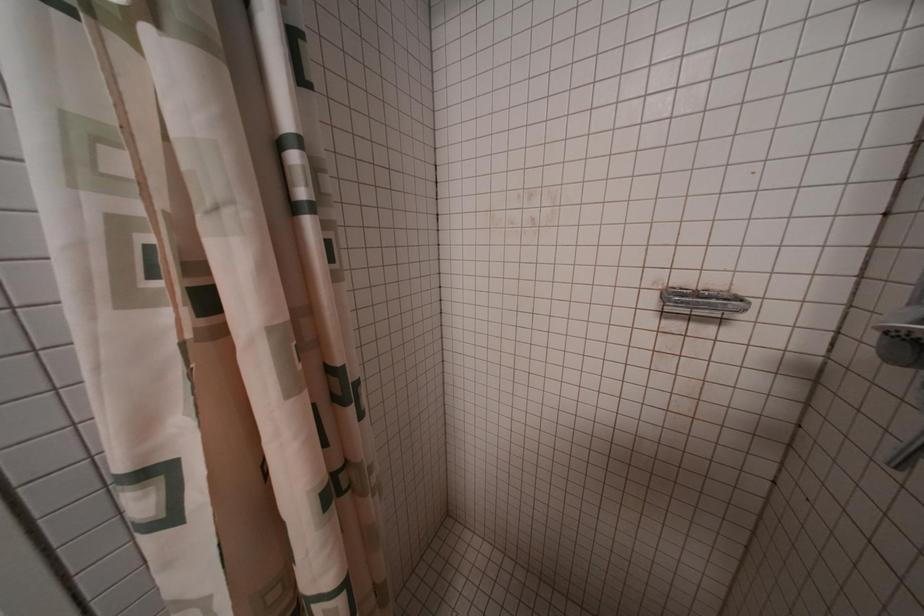
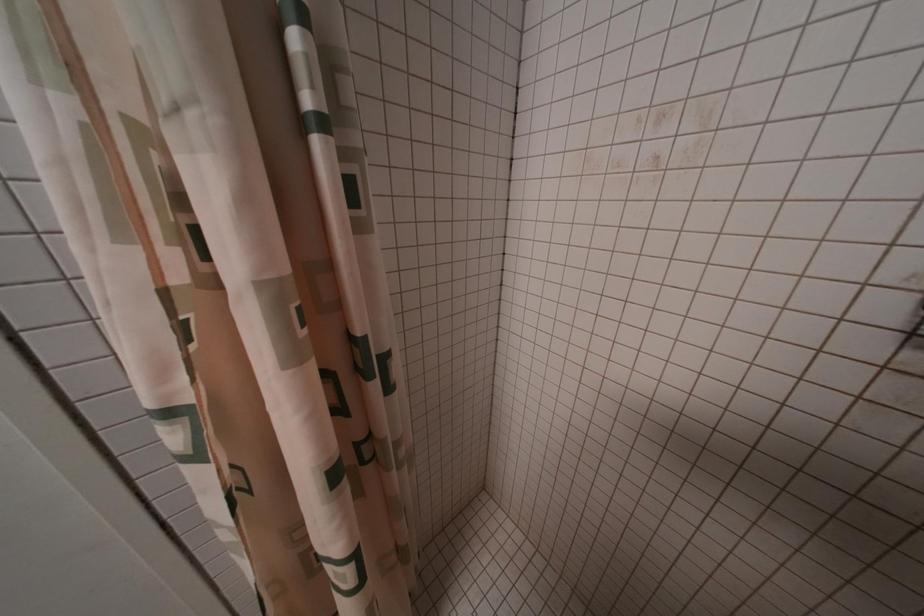
Question: The images are taken continuously from a first-person perspective. In which direction are you moving?

Choices:
 (A) Left
 (B) Right
 (C) Forward
 (D) Backward

Answer: (C)